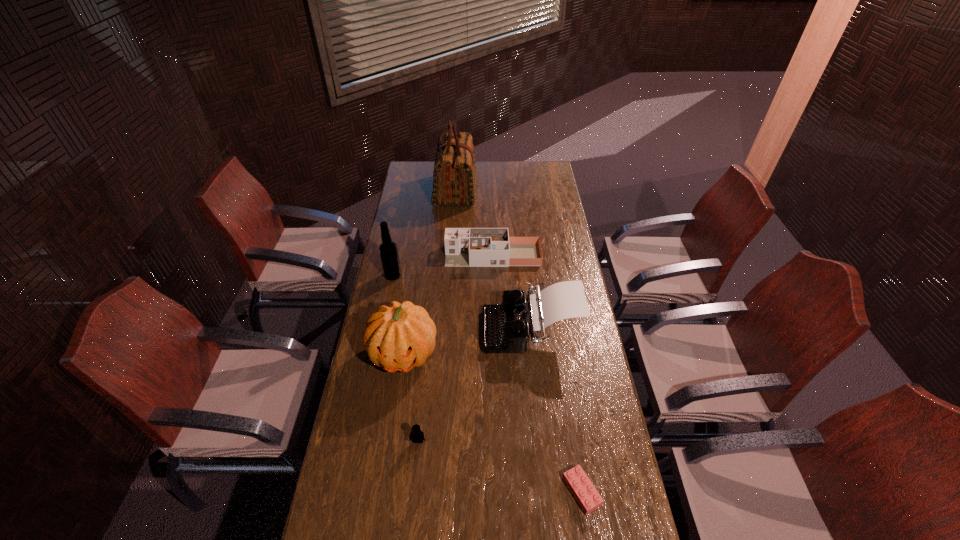
Where is `vacant space situated 0.250m on the open handle side of the farthest object`? The image size is (960, 540). vacant space situated 0.250m on the open handle side of the farthest object is located at coordinates (524, 191).

Locate an element on the screen. Image resolution: width=960 pixels, height=540 pixels. free space located on the front of the beer bottle is located at coordinates (377, 351).

Find the location of a particular element. This screenshot has height=540, width=960. vacant space located 0.240m on the carved face of the pumpkin is located at coordinates (389, 453).

The width and height of the screenshot is (960, 540). I want to click on blank space located 0.060m on the keys of the fourth shortest object, so click(x=467, y=329).

Find the location of `free spot located 0.300m on the keys of the fourth shortest object`. free spot located 0.300m on the keys of the fourth shortest object is located at coordinates (403, 329).

Image resolution: width=960 pixels, height=540 pixels. I want to click on vacant space located 0.380m on the keys of the fourth shortest object, so click(383, 329).

I want to click on free region located 0.190m at the front door of the second farthest object, so click(403, 255).

Find the location of `vacant region located 0.140m at the front door of the second farthest object`. vacant region located 0.140m at the front door of the second farthest object is located at coordinates (415, 255).

In order to click on vacant area situated 0.260m at the front door of the second farthest object in this screenshot , I will do `click(388, 255)`.

Identify the location of free space located on the front-facing side of the left Lego. (414, 480).